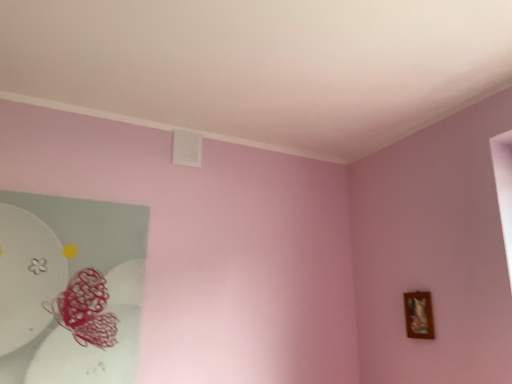
In order to click on wooden picture frame at lower right in this screenshot , I will do `click(419, 315)`.

This screenshot has height=384, width=512. What do you see at coordinates (419, 315) in the screenshot?
I see `wooden picture frame at lower right` at bounding box center [419, 315].

Image resolution: width=512 pixels, height=384 pixels. I want to click on wooden picture frame at lower right, so 419,315.